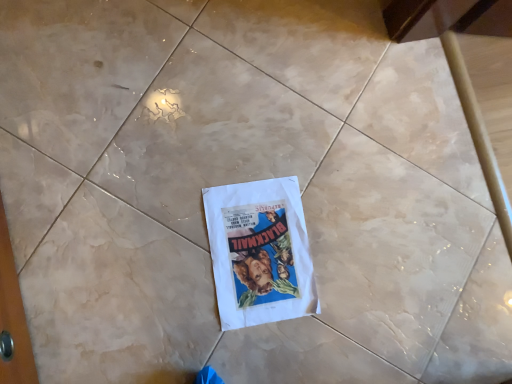
Where is `spots to the right of white paper flyer at center`? The height and width of the screenshot is (384, 512). spots to the right of white paper flyer at center is located at coordinates (352, 306).